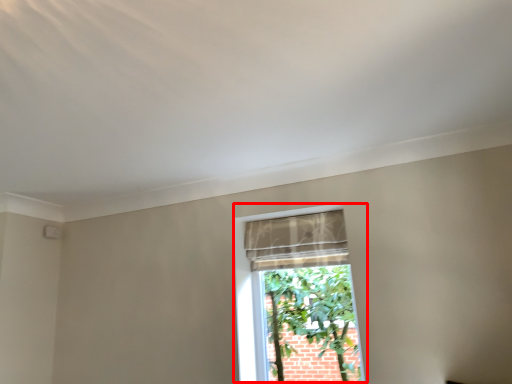
Question: Observing the image, what is the correct spatial positioning of window (annotated by the red box) in reference to curtain?

Choices:
 (A) right
 (B) left

Answer: (A)